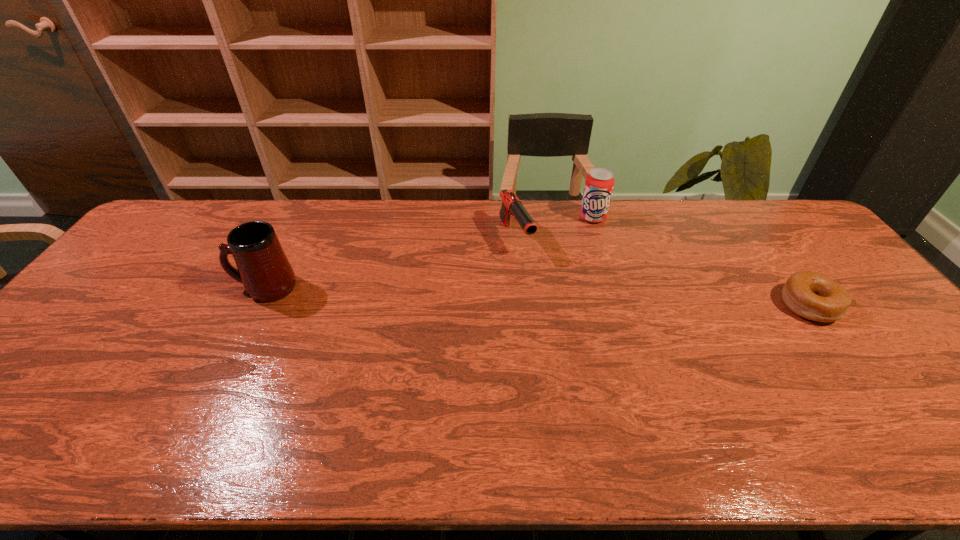
Identify the location of mug. (263, 268).

The height and width of the screenshot is (540, 960). Find the location of `the rightmost object`. the rightmost object is located at coordinates (x=812, y=295).

Identify the location of the shortest object. The width and height of the screenshot is (960, 540). (812, 295).

Where is `the third object from right to left`? The width and height of the screenshot is (960, 540). the third object from right to left is located at coordinates (511, 206).

Identify the location of the second shortest object. The image size is (960, 540). (511, 206).

Where is `soda can`? The width and height of the screenshot is (960, 540). soda can is located at coordinates (599, 183).

The height and width of the screenshot is (540, 960). In order to click on free region located on the side of the mug with the handle in this screenshot , I will do point(168,288).

At what (x,y) coordinates should I click in order to perform the action: click on vacant space positioned on the side of the mug with the handle. Please return your answer as a coordinate pair (x, y). Looking at the image, I should click on (168, 288).

You are a GUI agent. You are given a task and a screenshot of the screen. Output one action in this format:
    pyautogui.click(x=<x>, y=<y>)
    Task: Click on the vacant region located 0.090m on the side of the mug with the handle
    
    Given the screenshot: What is the action you would take?
    pyautogui.click(x=203, y=288)

Where is `free region located on the front of the shortest object`? The height and width of the screenshot is (540, 960). free region located on the front of the shortest object is located at coordinates (881, 401).